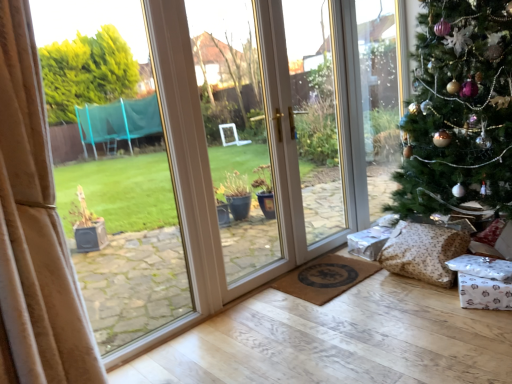
Question: Should I look upward or downward to see brown textured doormat at lower center?

Choices:
 (A) down
 (B) up

Answer: (A)

Question: Is brown textured doormat at lower center located outside brown textured pillow at lower right?

Choices:
 (A) no
 (B) yes

Answer: (B)

Question: Is brown textured pillow at lower right inside brown textured doormat at lower center?

Choices:
 (A) yes
 (B) no

Answer: (B)

Question: Does brown textured doormat at lower center have a lesser height compared to brown textured pillow at lower right?

Choices:
 (A) no
 (B) yes

Answer: (B)

Question: Is brown textured doormat at lower center far from brown textured pillow at lower right?

Choices:
 (A) no
 (B) yes

Answer: (A)

Question: Is brown textured doormat at lower center at the right side of brown textured pillow at lower right?

Choices:
 (A) yes
 (B) no

Answer: (B)

Question: Can you confirm if brown textured doormat at lower center is positioned to the left of brown textured pillow at lower right?

Choices:
 (A) yes
 (B) no

Answer: (A)

Question: Considering the relative sizes of brown textured pillow at lower right and green textured christmas tree at right in the image provided, is brown textured pillow at lower right smaller than green textured christmas tree at right?

Choices:
 (A) yes
 (B) no

Answer: (A)

Question: Considering the relative positions of brown textured pillow at lower right and green textured christmas tree at right in the image provided, is brown textured pillow at lower right to the right of green textured christmas tree at right from the viewer's perspective?

Choices:
 (A) yes
 (B) no

Answer: (B)

Question: Does brown textured pillow at lower right contain green textured christmas tree at right?

Choices:
 (A) yes
 (B) no

Answer: (B)

Question: From a real-world perspective, is brown textured pillow at lower right physically below green textured christmas tree at right?

Choices:
 (A) no
 (B) yes

Answer: (B)

Question: Can you confirm if brown textured pillow at lower right is shorter than green textured christmas tree at right?

Choices:
 (A) yes
 (B) no

Answer: (A)

Question: Is brown textured pillow at lower right oriented away from green textured christmas tree at right?

Choices:
 (A) yes
 (B) no

Answer: (A)

Question: Is brown textured doormat at lower center surrounded by green textured christmas tree at right?

Choices:
 (A) yes
 (B) no

Answer: (B)